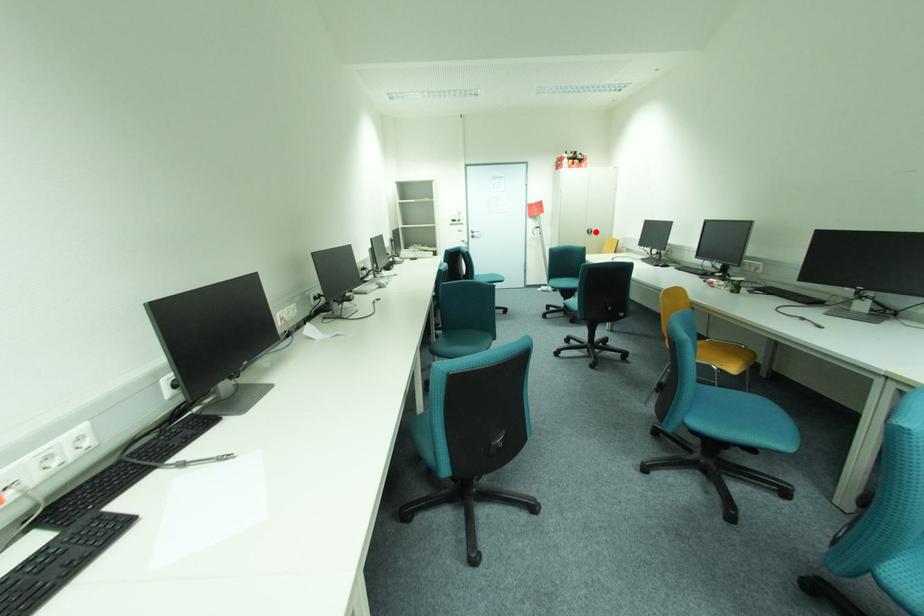
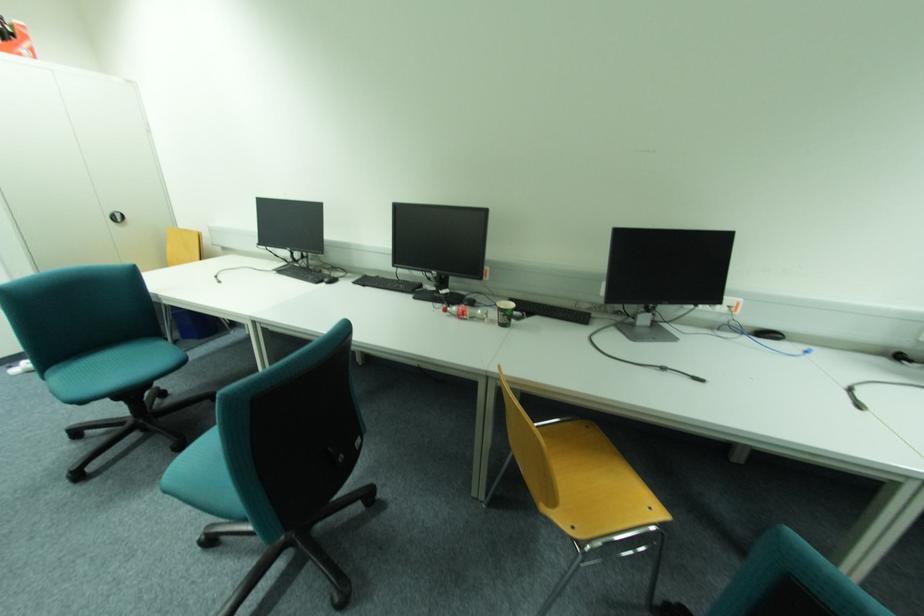
The point at the highlighted location is marked in the first image. Where is the corresponding point in the second image?

(126, 219)